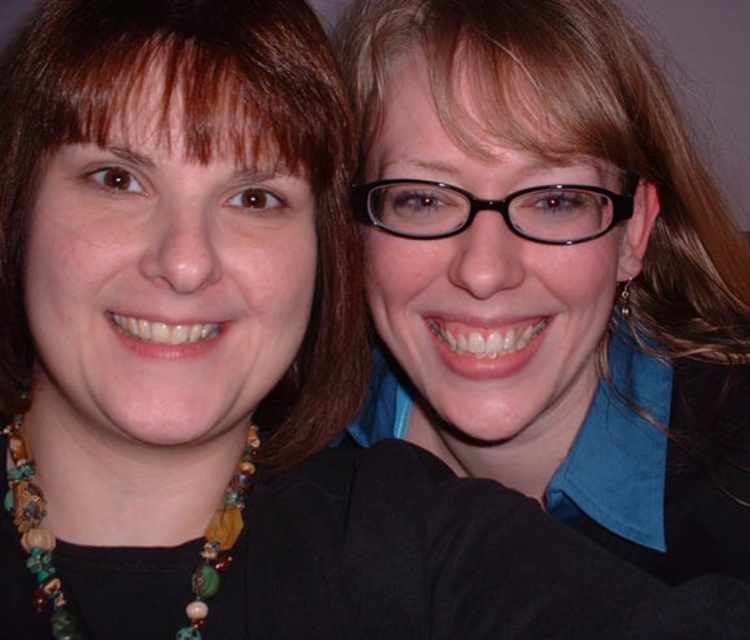
Between point (224, 67) and point (388, 179), which one is positioned behind?

The point (388, 179) is more distant.

Does brown hair at left have a smaller size compared to black plastic glasses at center?

Incorrect, brown hair at left is not smaller in size than black plastic glasses at center.

Does point (162, 20) lie behind point (519, 189)?

No, (162, 20) is in front of (519, 189).

The width and height of the screenshot is (750, 640). In order to click on brown hair at left in this screenshot , I will do `click(198, 160)`.

Is matte black hair at upper right further to camera compared to black plastic glasses at center?

No, it is not.

Where is `matte black hair at upper right`? Image resolution: width=750 pixels, height=640 pixels. matte black hair at upper right is located at coordinates (525, 225).

I want to click on matte black hair at upper right, so click(525, 225).

Is black plastic glasses at center shorter than multicolored beaded necklace at lower left?

Indeed, black plastic glasses at center has a lesser height compared to multicolored beaded necklace at lower left.

Can you confirm if black plastic glasses at center is taller than multicolored beaded necklace at lower left?

No.

Is point (568, 234) farther from camera compared to point (186, 628)?

Yes, point (568, 234) is farther from viewer.

Locate an element on the screen. black plastic glasses at center is located at coordinates (492, 209).